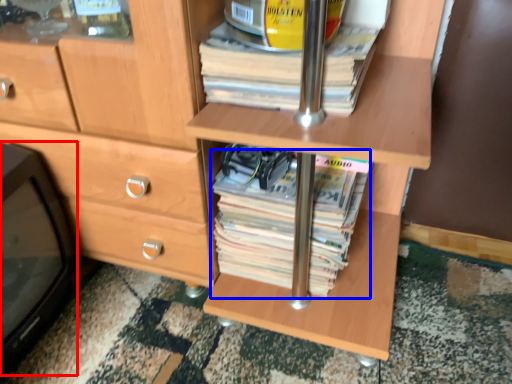
Question: Among these objects, which one is nearest to the camera, desktop (highlighted by a red box) or paperback book (highlighted by a blue box)?

Choices:
 (A) desktop
 (B) paperback book

Answer: (A)